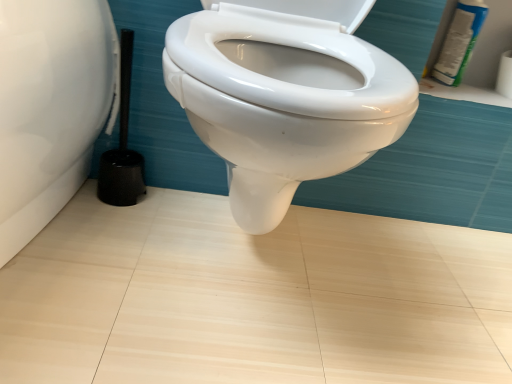
At what (x,y) coordinates should I click in order to perform the action: click on black plastic brush at left. Please return your answer as a coordinate pair (x, y). This screenshot has height=384, width=512. Looking at the image, I should click on (122, 144).

What is the approximate height of black plastic brush at left?

14.63 inches.

Describe the element at coordinates (122, 144) in the screenshot. I see `black plastic brush at left` at that location.

What do you see at coordinates (459, 42) in the screenshot? This screenshot has width=512, height=384. I see `white glossy spray can at upper right` at bounding box center [459, 42].

Find the location of a particular element. This screenshot has width=512, height=384. white glossy spray can at upper right is located at coordinates (459, 42).

Image resolution: width=512 pixels, height=384 pixels. In order to click on black plastic brush at left in this screenshot , I will do `click(122, 144)`.

Considering the positions of objects black plastic brush at left and white glossy spray can at upper right in the image provided, who is more to the right, black plastic brush at left or white glossy spray can at upper right?

white glossy spray can at upper right.

Looking at this image, considering the relative positions of black plastic brush at left and white glossy spray can at upper right in the image provided, is black plastic brush at left in front of white glossy spray can at upper right?

Yes, black plastic brush at left is in front of white glossy spray can at upper right.

Which is in front, point (122, 63) or point (484, 17)?

The point (122, 63) is closer to the camera.

From the image's perspective, which is above, black plastic brush at left or white glossy spray can at upper right?

From the image's view, white glossy spray can at upper right is above.

From a real-world perspective, is black plastic brush at left positioned over white glossy spray can at upper right based on gravity?

No, from a real-world perspective, black plastic brush at left is not above white glossy spray can at upper right.

Does black plastic brush at left have a greater width compared to white glossy spray can at upper right?

Indeed, black plastic brush at left has a greater width compared to white glossy spray can at upper right.

Is black plastic brush at left taller than white glossy spray can at upper right?

Indeed, black plastic brush at left has a greater height compared to white glossy spray can at upper right.

Considering the sizes of black plastic brush at left and white glossy spray can at upper right in the image, is black plastic brush at left bigger or smaller than white glossy spray can at upper right?

In the image, black plastic brush at left appears to be larger than white glossy spray can at upper right.

Would you say white glossy spray can at upper right is part of black plastic brush at left's contents?

That's incorrect, white glossy spray can at upper right is not inside black plastic brush at left.

Is black plastic brush at left next to white glossy spray can at upper right?

No, black plastic brush at left is not with white glossy spray can at upper right.

Is black plastic brush at left oriented towards white glossy spray can at upper right?

No, black plastic brush at left does not turn towards white glossy spray can at upper right.

What are the coordinates of `brush located on the left of white glossy spray can at upper right` in the screenshot? It's located at (122, 144).

Between white glossy spray can at upper right and black plastic brush at left, which one appears on the right side from the viewer's perspective?

From the viewer's perspective, white glossy spray can at upper right appears more on the right side.

Is white glossy spray can at upper right positioned behind black plastic brush at left?

Yes, white glossy spray can at upper right is behind black plastic brush at left.

Is point (453, 81) closer to camera compared to point (123, 148)?

No, (453, 81) is behind (123, 148).

From the image's perspective, is white glossy spray can at upper right over black plastic brush at left?

Indeed, from the image's perspective, white glossy spray can at upper right is shown above black plastic brush at left.

From a real-world perspective, is white glossy spray can at upper right located beneath black plastic brush at left?

No, from a real-world perspective, white glossy spray can at upper right is not beneath black plastic brush at left.

Considering the relative sizes of white glossy spray can at upper right and black plastic brush at left in the image provided, is white glossy spray can at upper right thinner than black plastic brush at left?

Yes.

Who is taller, white glossy spray can at upper right or black plastic brush at left?

With more height is black plastic brush at left.

Between white glossy spray can at upper right and black plastic brush at left, which one has larger size?

Bigger between the two is black plastic brush at left.

Is black plastic brush at left a part of white glossy spray can at upper right?

No, black plastic brush at left is not a part of white glossy spray can at upper right.

Based on the photo, is there a large distance between white glossy spray can at upper right and black plastic brush at left?

Actually, white glossy spray can at upper right and black plastic brush at left are a little close together.

Is white glossy spray can at upper right facing towards black plastic brush at left?

No, white glossy spray can at upper right is not aimed at black plastic brush at left.

Measure the distance from white glossy spray can at upper right to black plastic brush at left.

white glossy spray can at upper right and black plastic brush at left are 31.02 inches apart from each other.

I want to click on toiletry that is behind the black plastic brush at left, so click(x=459, y=42).

This screenshot has width=512, height=384. I want to click on brush that appears on the left of white glossy spray can at upper right, so click(x=122, y=144).

Locate an element on the screen. This screenshot has width=512, height=384. toiletry behind the black plastic brush at left is located at coordinates (459, 42).